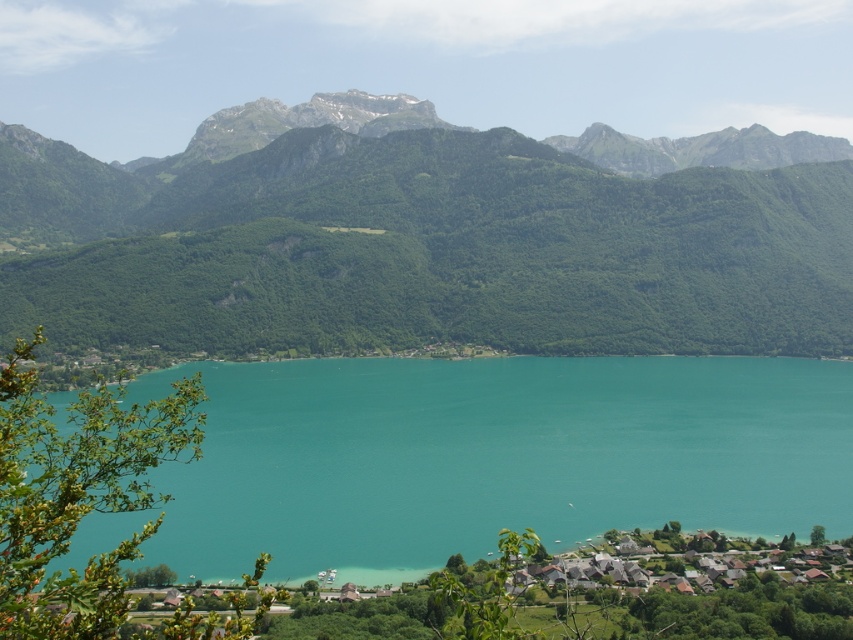
Question: Which of these objects is positioned closest to the green forested mountain at center?

Choices:
 (A) white wooden houses at lower right
 (B) turquoise water at center

Answer: (B)

Question: Can you confirm if turquoise water at center is thinner than white wooden houses at lower right?

Choices:
 (A) yes
 (B) no

Answer: (B)

Question: Can you confirm if turquoise water at center is positioned above white wooden houses at lower right?

Choices:
 (A) yes
 (B) no

Answer: (A)

Question: Which of the following is the farthest from the observer?

Choices:
 (A) (323, 198)
 (B) (809, 592)
 (C) (380, 435)

Answer: (A)

Question: Estimate the real-world distances between objects in this image. Which object is farther from the turquoise water at center?

Choices:
 (A) white wooden houses at lower right
 (B) green forested mountain at center

Answer: (B)

Question: Is green forested mountain at center positioned before turquoise water at center?

Choices:
 (A) no
 (B) yes

Answer: (A)